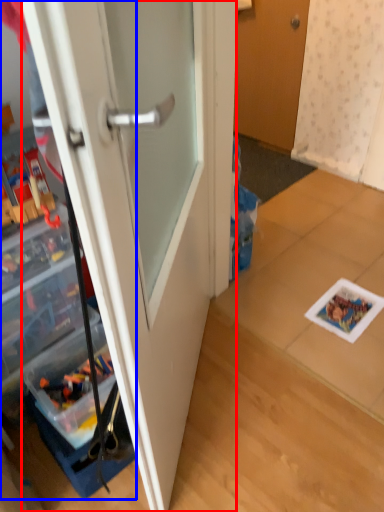
Question: Which object appears farthest to the camera in this image, door (highlighted by a red box) or cabinetry (highlighted by a blue box)?

Choices:
 (A) door
 (B) cabinetry

Answer: (B)